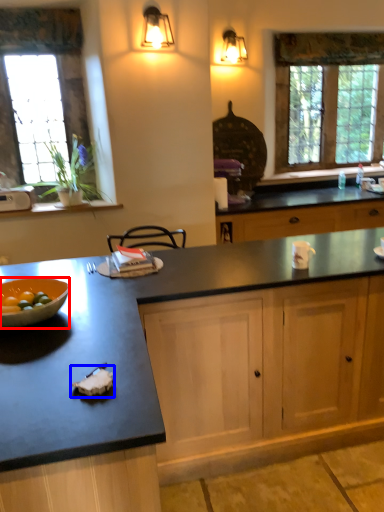
Question: Which point is closer to the camera, bowl (highlighted by a red box) or food (highlighted by a blue box)?

Choices:
 (A) bowl
 (B) food

Answer: (B)